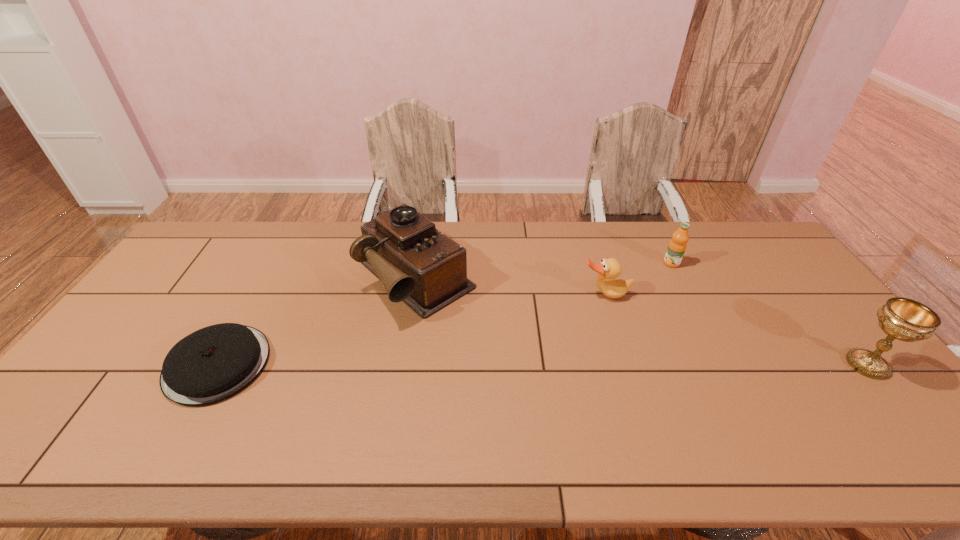
At what (x,y) coordinates should I click in order to perform the action: click on vacant space located on the beak of the third object from left to right. Please return your answer as a coordinate pair (x, y). The height and width of the screenshot is (540, 960). Looking at the image, I should click on (637, 375).

Locate an element on the screen. The image size is (960, 540). vacant position located on the horn of the second object from left to right is located at coordinates (476, 333).

Locate an element on the screen. free space located 0.220m on the horn of the second object from left to right is located at coordinates (506, 358).

Where is `free point located on the horn of the second object from left to right`? free point located on the horn of the second object from left to right is located at coordinates (533, 381).

Locate an element on the screen. This screenshot has height=540, width=960. blank space located 0.110m on the label of the orange juice is located at coordinates (647, 280).

Identify the location of vacant space situated 0.090m on the label of the orange juice. This screenshot has height=540, width=960. (651, 278).

Locate an element on the screen. vacant area situated 0.160m on the label of the orange juice is located at coordinates (637, 287).

Find the location of `phonograph_record that is at the far edge`. phonograph_record that is at the far edge is located at coordinates (417, 264).

Identify the location of orange juice at the far edge. The image size is (960, 540). (677, 246).

Identify the location of object at the near edge. This screenshot has height=540, width=960. (214, 363).